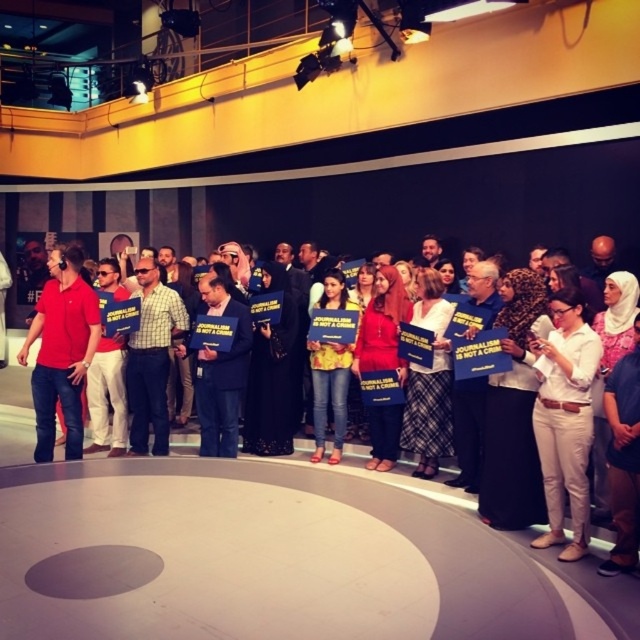
Question: Does white cotton pants at lower right have a lesser width compared to matte blue folder at center?

Choices:
 (A) no
 (B) yes

Answer: (A)

Question: Can you confirm if white cotton pants at lower right is positioned below matte blue folder at center?

Choices:
 (A) yes
 (B) no

Answer: (B)

Question: Which point appears closest to the camera in this image?

Choices:
 (A) (51, 310)
 (B) (3, 417)

Answer: (A)

Question: Which of the following is the closest to the observer?

Choices:
 (A) white cotton pants at lower right
 (B) matte blue folder at center

Answer: (A)

Question: Which point is closer to the camera?

Choices:
 (A) (16, 433)
 (B) (552, 476)
 (C) (17, 355)

Answer: (B)

Question: Can you confirm if matte red polo shirt at left is thinner than matte blue folder at center?

Choices:
 (A) yes
 (B) no

Answer: (B)